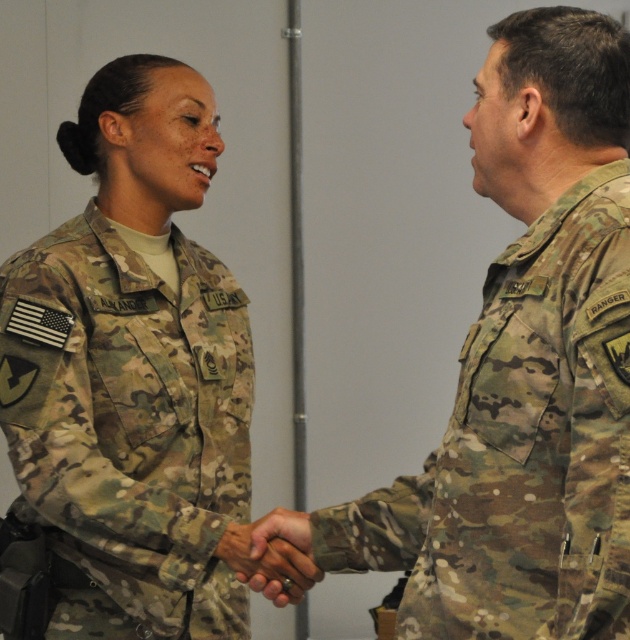
Consider the image. Is camouflage uniform at right thinner than camouflage fabric uniform at center?

No.

Between camouflage uniform at right and camouflage fabric uniform at center, which one has less height?

camouflage fabric uniform at center is shorter.

Where is `camouflage uniform at right`? The height and width of the screenshot is (640, 630). camouflage uniform at right is located at coordinates (527, 368).

Who is more distant from viewer, (x=508, y=524) or (x=248, y=572)?

The point (x=248, y=572) is behind.

Which is behind, point (518, 433) or point (232, 554)?

The point (232, 554) is more distant.

Find the location of a particular element. This screenshot has height=640, width=630. camouflage uniform at right is located at coordinates (527, 368).

Is camouflage fabric uniform at center wider than camouflage fabric hand at center?

Correct, the width of camouflage fabric uniform at center exceeds that of camouflage fabric hand at center.

Who is shorter, camouflage fabric uniform at center or camouflage fabric hand at center?

Standing shorter between the two is camouflage fabric hand at center.

Between point (209, 520) and point (297, 538), which one is positioned behind?

Point (209, 520)

You are a GUI agent. You are given a task and a screenshot of the screen. Output one action in this format:
    pyautogui.click(x=<x>, y=<y>)
    Task: Click on the camouflage fabric uniform at center
    This screenshot has width=630, height=640.
    Given the screenshot: What is the action you would take?
    pyautogui.click(x=129, y=426)